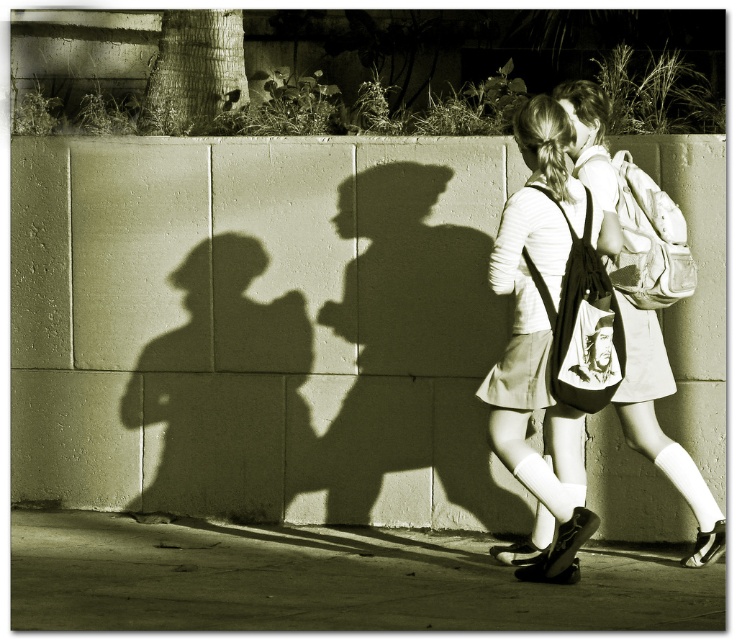
Question: Based on their relative distances, which object is farther from the matte white backpack at center?

Choices:
 (A) smooth concrete pavement at lower center
 (B) matte fabric backpack at center

Answer: (A)

Question: Does smooth concrete pavement at lower center appear on the right side of matte white backpack at center?

Choices:
 (A) yes
 (B) no

Answer: (B)

Question: Which point is farther to the camera?

Choices:
 (A) (601, 369)
 (B) (486, 604)
 (C) (534, 579)
 (D) (656, 456)

Answer: (D)

Question: Is the position of matte white backpack at center less distant than that of matte fabric backpack at center?

Choices:
 (A) yes
 (B) no

Answer: (A)

Question: Which object is farther from the camera taking this photo?

Choices:
 (A) matte fabric backpack at center
 (B) smooth concrete pavement at lower center
 (C) smooth black hoodie at center

Answer: (A)

Question: Can you confirm if matte fabric backpack at center is positioned above smooth black hoodie at center?

Choices:
 (A) no
 (B) yes

Answer: (B)